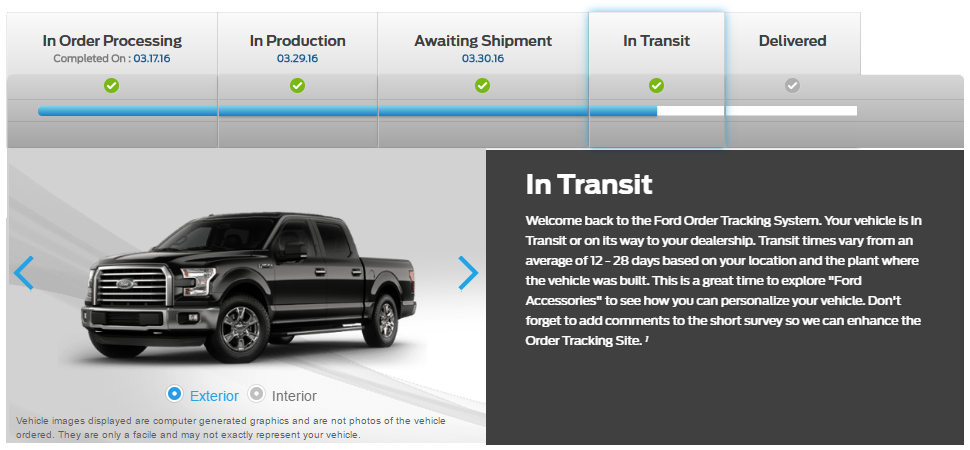
This screenshot has width=970, height=450. In order to click on windows in this screenshot , I will do `click(230, 232)`, `click(295, 234)`, `click(336, 232)`, `click(199, 238)`.